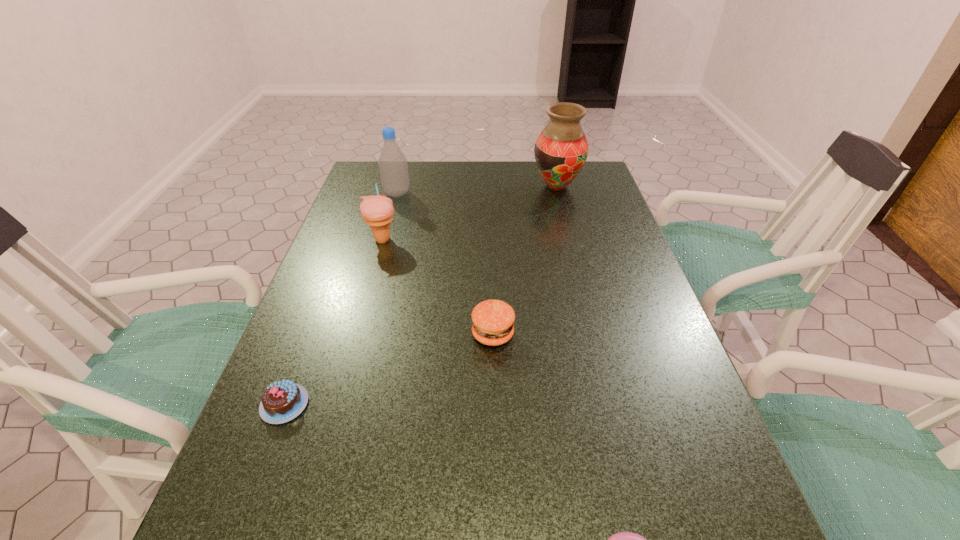
Identify the location of vacant area situated 0.060m on the right of the third farthest object. The width and height of the screenshot is (960, 540). (420, 240).

The width and height of the screenshot is (960, 540). Identify the location of vacant space positioned on the back of the third shortest object. (492, 281).

Find the location of a particular element. The height and width of the screenshot is (540, 960). free space located on the back of the fifth farthest object is located at coordinates (316, 322).

You are a GUI agent. You are given a task and a screenshot of the screen. Output one action in this format:
    pyautogui.click(x=<x>, y=<y>)
    Task: Click on the vase present at the far edge
    The height and width of the screenshot is (540, 960).
    Given the screenshot: What is the action you would take?
    pyautogui.click(x=561, y=150)

This screenshot has height=540, width=960. I want to click on bottle located in the far edge section of the desktop, so click(x=393, y=167).

You are a GUI agent. You are given a task and a screenshot of the screen. Output one action in this format:
    pyautogui.click(x=<x>, y=<y>)
    Task: Click on the bottle that is positioned at the left edge
    The image size is (960, 540).
    Given the screenshot: What is the action you would take?
    pyautogui.click(x=393, y=167)

Image resolution: width=960 pixels, height=540 pixels. I want to click on icecream that is at the left edge, so click(377, 211).

This screenshot has width=960, height=540. Find the location of `chocolate cake located in the left edge section of the desktop`. chocolate cake located in the left edge section of the desktop is located at coordinates click(282, 401).

You are a GUI agent. You are given a task and a screenshot of the screen. Output one action in this format:
    pyautogui.click(x=<x>, y=<y>)
    Task: Click on the object that is at the right edge
    This screenshot has height=540, width=960.
    Given the screenshot: What is the action you would take?
    pyautogui.click(x=561, y=150)

Where is `object positioned at the far left corner`? This screenshot has width=960, height=540. object positioned at the far left corner is located at coordinates (393, 167).